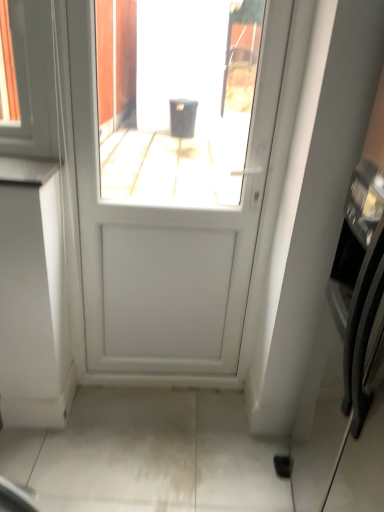
Image resolution: width=384 pixels, height=512 pixels. Identify the location of white glossy countertop at left. (27, 170).

From the image's perspective, is white glossy countertop at left over white matte door at center?

Yes.

Locate an element on the screen. door that appears below the white glossy countertop at left (from a real-world perspective) is located at coordinates click(176, 188).

Which is closer, (24, 159) or (172, 157)?

Clearly, point (24, 159) is closer to the camera than point (172, 157).

From a real-world perspective, is white glossy countertop at left under white matte door at center?

No, from a real-world perspective, white glossy countertop at left is not beneath white matte door at center.

Which of these two, white matte door at center or satin black oven at right, is smaller?

With smaller size is white matte door at center.

From the picture: Which is more to the left, white matte door at center or satin black oven at right?

white matte door at center.

From the image's perspective, who appears lower, white matte door at center or satin black oven at right?

satin black oven at right, from the image's perspective.

From a real-world perspective, who is located lower, white matte door at center or satin black oven at right?

satin black oven at right, from a real-world perspective.

Does white matte door at center touch white glossy countertop at left?

They are not placed beside each other.

Is white matte door at center bigger than white glossy countertop at left?

Indeed, white matte door at center has a larger size compared to white glossy countertop at left.

Is white matte door at center turned away from white glossy countertop at left?

white matte door at center is not turned away from white glossy countertop at left.

In the scene shown: How distant is white matte door at center from white glossy countertop at left?

58.85 centimeters.

Who is shorter, satin black oven at right or white matte door at center?

white matte door at center is shorter.

Is white matte door at center inside satin black oven at right?

Actually, white matte door at center is outside satin black oven at right.

Is white matte door at center at the back of satin black oven at right?

No, satin black oven at right is not facing the opposite direction of white matte door at center.

Are satin black oven at right and white matte door at center beside each other?

No.

In the image, is satin black oven at right positioned in front of or behind white glossy countertop at left?

In the image, satin black oven at right appears in front of white glossy countertop at left.

Between satin black oven at right and white glossy countertop at left, which one has smaller size?

With smaller size is white glossy countertop at left.

Identify the location of counter top above the satin black oven at right (from a real-world perspective). This screenshot has height=512, width=384. (27, 170).

Does point (382, 497) appear closer or farther from the camera than point (13, 161)?

Point (382, 497).

Is white glossy countertop at left thinner than satin black oven at right?

Yes.

From the picture: How distant is white glossy countertop at left from satin black oven at right?

They are 1.28 meters apart.

Is white glossy countertop at left taller than satin black oven at right?

Incorrect, the height of white glossy countertop at left is not larger of that of satin black oven at right.

Locate an element on the screen. The width and height of the screenshot is (384, 512). door in front of the white glossy countertop at left is located at coordinates (176, 188).

Find the location of `door above the satin black oven at right (from a real-world perspective)`. door above the satin black oven at right (from a real-world perspective) is located at coordinates (176, 188).

Which object lies nearer to the anchor point white matte door at center, white glossy countertop at left or satin black oven at right?

Among the two, white glossy countertop at left is located nearer to white matte door at center.

From the image, which object appears to be farther from satin black oven at right, white matte door at center or white glossy countertop at left?

white glossy countertop at left is further to satin black oven at right.

Considering their positions, is white glossy countertop at left positioned further to satin black oven at right than white matte door at center?

The object further to satin black oven at right is white glossy countertop at left.

When comparing their distances from white glossy countertop at left, does white matte door at center or satin black oven at right seem further?

Based on the image, satin black oven at right appears to be further to white glossy countertop at left.

Estimate the real-world distances between objects in this image. Which object is closer to white glossy countertop at left, satin black oven at right or white matte door at center?

The object closer to white glossy countertop at left is white matte door at center.

Based on their spatial positions, is satin black oven at right or white glossy countertop at left further from white matte door at center?

satin black oven at right is further to white matte door at center.

Locate an element on the screen. This screenshot has height=512, width=384. door situated between white glossy countertop at left and satin black oven at right from left to right is located at coordinates (176, 188).